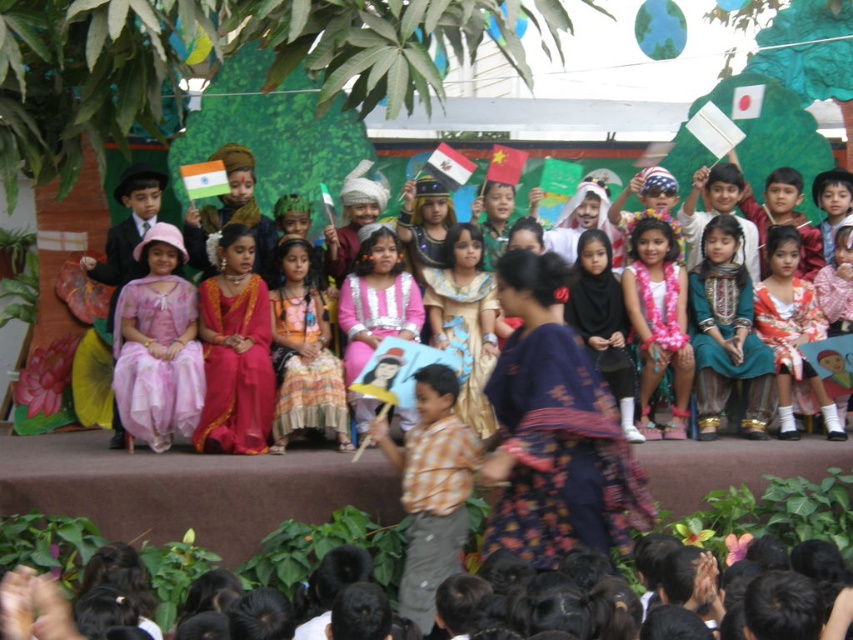
You are a photographer standing at the back of the stage. You want to take a photo of the dark blue floral fabric dress at center and the pink satin dress at left. How far apart are these two dresses from each other?

The dark blue floral fabric dress at center is 19.77 meters away from the pink satin dress at left.

You are a photographer taking a picture of the cultural event. You notice the pink satin dress at left and the red fabric flag at center. Which object should you focus on first to ensure both are in sharp focus?

The pink satin dress at left is closer to the viewer than the red fabric flag at center. To ensure both are in sharp focus, you should focus on the pink satin dress at left first, as it is the closer object.

You are a photographer at the event and want to capture a photo of the dark blue floral fabric dress at center and the white paper flag at center. Which object should you focus on first if you want to ensure both are in focus, considering their sizes?

The dark blue floral fabric dress at center is much taller than the white paper flag at center. To ensure both are in focus, focus on the taller object first, which is the dark blue floral fabric dress at center.